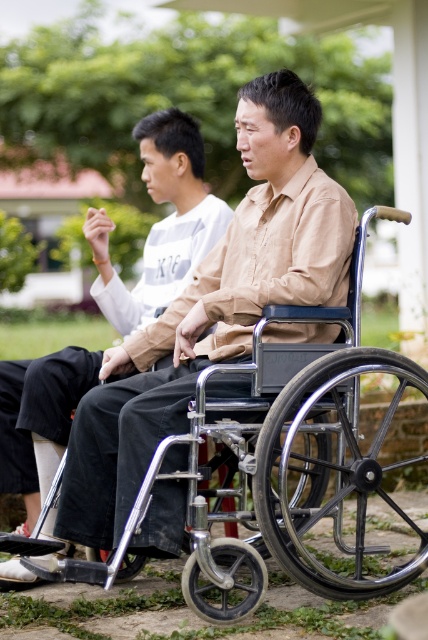
Does metallic silver wheelchair at center appear on the right side of matte black wheelchair at center?

Yes, metallic silver wheelchair at center is to the right of matte black wheelchair at center.

Is point (288, 557) closer to camera compared to point (82, 372)?

Yes, point (288, 557) is in front of point (82, 372).

Does point (320, 428) come farther from viewer compared to point (38, 493)?

No, it is not.

Locate an element on the screen. Image resolution: width=428 pixels, height=640 pixels. metallic silver wheelchair at center is located at coordinates (279, 465).